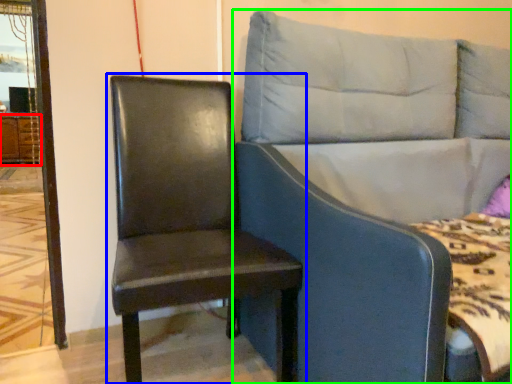
Question: Based on their relative distances, which object is nearer to dresser (highlighted by a red box)? Choose from chair (highlighted by a blue box) and studio couch (highlighted by a green box).

Choices:
 (A) chair
 (B) studio couch

Answer: (A)